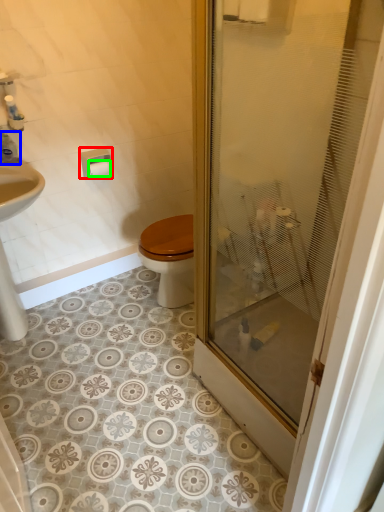
Question: Considering the real-world distances, which object is closest to towel bar (highlighted by a red box)? toiletry (highlighted by a blue box) or toilet paper (highlighted by a green box).

Choices:
 (A) toiletry
 (B) toilet paper

Answer: (B)